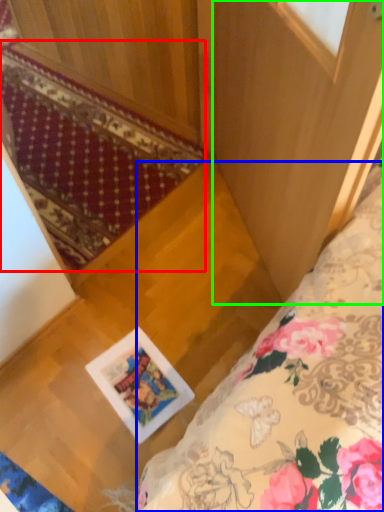
Question: Estimate the real-world distances between objects in this image. Which object is farther from mat (highlighted by a red box), bed (highlighted by a blue box) or screen door (highlighted by a green box)?

Choices:
 (A) bed
 (B) screen door

Answer: (A)